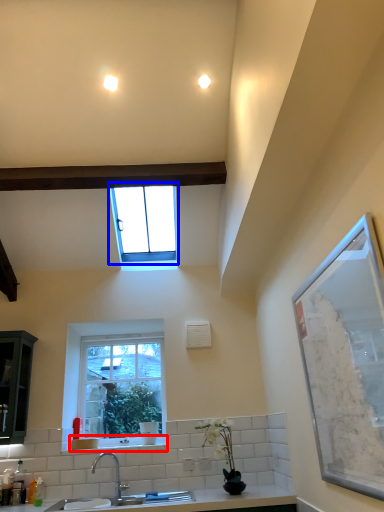
Question: Which point is closer to the camera, window sill (highlighted by a red box) or window (highlighted by a blue box)?

Choices:
 (A) window sill
 (B) window

Answer: (B)